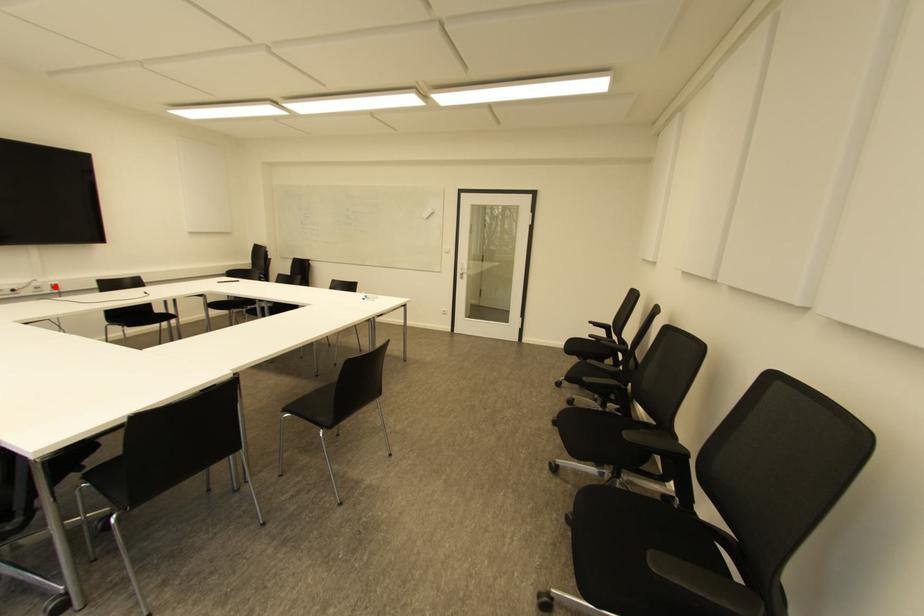
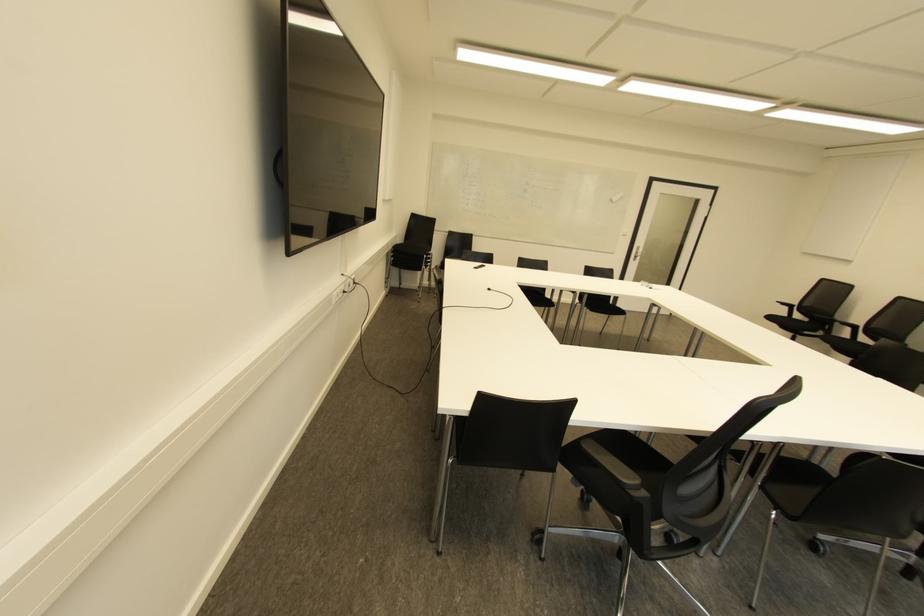
Question: A red point is marked in image1. In image2, is the corresponding 3D point closer to the camera or farther? Reply with the corresponding letter.

Choices:
 (A) The corresponding 3D point is closer.
 (B) The corresponding 3D point is farther.

Answer: (A)